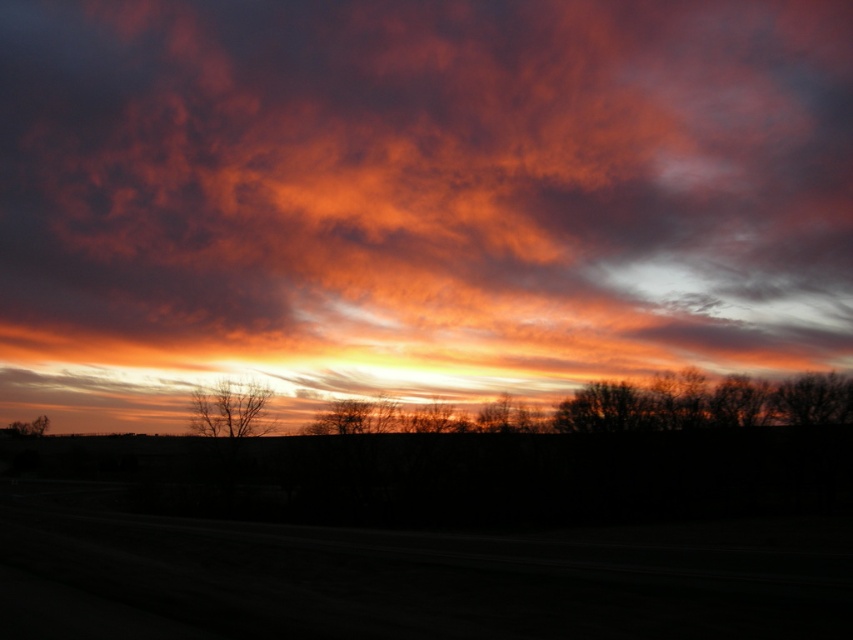
The width and height of the screenshot is (853, 640). Identify the location of silhouetted bare branches at center. (606, 410).

Can you confirm if silhouetted bare branches at center is positioned below brown matte tree at lower left?

Incorrect, silhouetted bare branches at center is not positioned below brown matte tree at lower left.

Is point (621, 397) farther from viewer compared to point (39, 429)?

No, it is in front of (39, 429).

At what (x,y) coordinates should I click in order to perform the action: click on silhouetted bare branches at center. Please return your answer as a coordinate pair (x, y). The image size is (853, 640). Looking at the image, I should click on point(606,410).

Is bare branches at center positioned in front of brown matte tree at lower left?

Yes, bare branches at center is closer to the viewer.

Which is behind, point (223, 412) or point (12, 435)?

The point (12, 435) is behind.

This screenshot has height=640, width=853. Identify the location of bare branches at center. (229, 408).

Who is lower down, brown matte tree at center or brown matte tree at lower left?

brown matte tree at lower left is lower down.

Who is higher up, brown matte tree at center or brown matte tree at lower left?

brown matte tree at center

Does point (521, 429) lie behind point (10, 422)?

That is False.

Where is `brown matte tree at center`? The width and height of the screenshot is (853, 640). brown matte tree at center is located at coordinates 505,417.